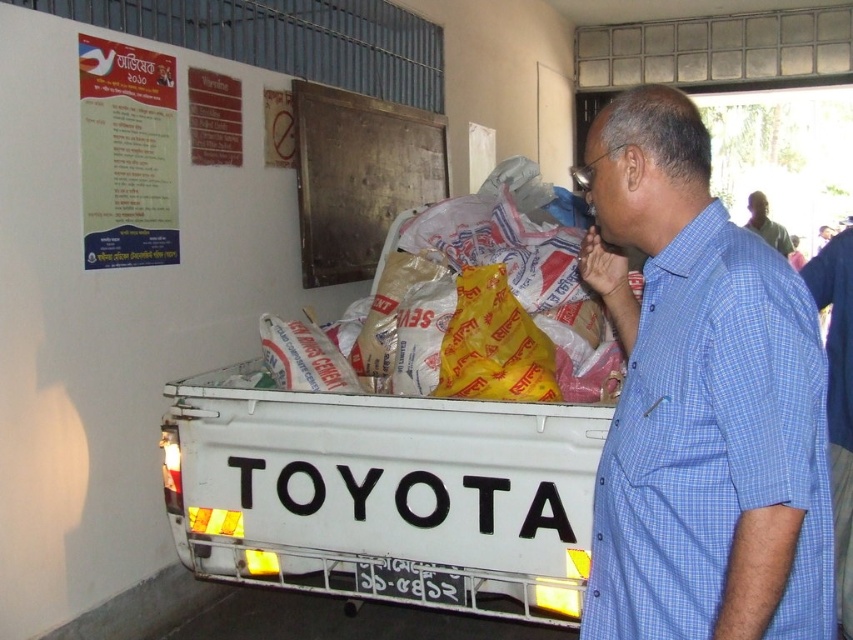
Which is behind, point (775, 272) or point (749, 220)?

The point (749, 220) is more distant.

Does blue checkered shirt at right appear under dark blue shirt at right?

Correct, blue checkered shirt at right is located below dark blue shirt at right.

Between point (627, 118) and point (759, 221), which one is positioned in front?

Positioned in front is point (627, 118).

Where is `blue checkered shirt at right`? The width and height of the screenshot is (853, 640). blue checkered shirt at right is located at coordinates (701, 401).

Between point (381, 196) and point (769, 241), which one is positioned behind?

Positioned behind is point (769, 241).

Is point (409, 156) more distant than point (787, 236)?

No.

Where is `wooden board at upper center`? This screenshot has width=853, height=640. wooden board at upper center is located at coordinates (358, 176).

What do you see at coordinates (701, 401) in the screenshot?
I see `blue checkered shirt at right` at bounding box center [701, 401].

Between point (685, 621) and point (310, 186), which one is positioned in front?

Point (685, 621) is in front.

You are a GUI agent. You are given a task and a screenshot of the screen. Output one action in this format:
    pyautogui.click(x=<x>, y=<y>)
    Task: Click on the blue checkered shirt at right
    
    Given the screenshot: What is the action you would take?
    point(701,401)

At what (x,y) coordinates should I click in order to perform the action: click on blue checkered shirt at right. Please return your answer as a coordinate pair (x, y). Looking at the image, I should click on (701, 401).